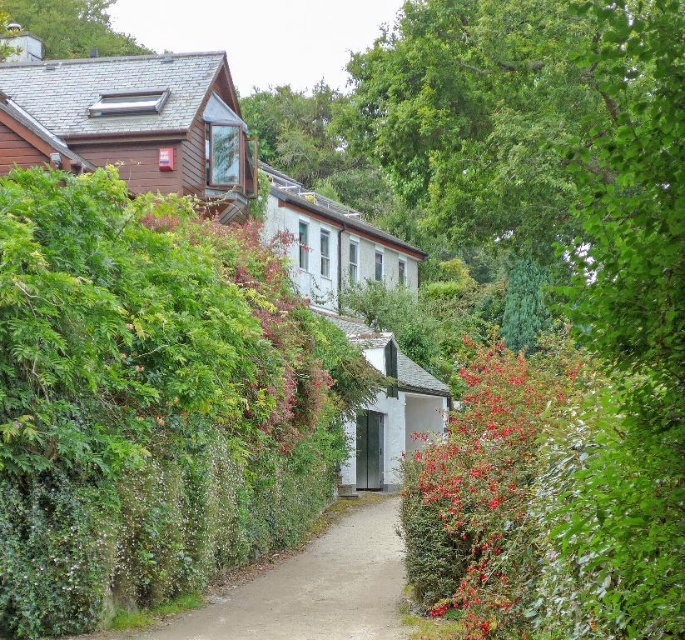
Question: Does wooden cabin at upper left have a smaller size compared to white matte cottage at center?

Choices:
 (A) yes
 (B) no

Answer: (A)

Question: Which object appears farthest from the camera in this image?

Choices:
 (A) dirt path at center
 (B) green leafy tree at upper left
 (C) red matte bush at center

Answer: (B)

Question: Can you confirm if wooden cabin at upper left is bigger than dirt path at center?

Choices:
 (A) yes
 (B) no

Answer: (A)

Question: Which object is the closest to the dirt path at center?

Choices:
 (A) green leafy tree at upper left
 (B) wooden cabin at upper left

Answer: (B)

Question: Which point appears closest to the camera in this image?

Choices:
 (A) (49, 42)
 (B) (316, 557)
 (C) (451, 609)

Answer: (C)

Question: Does green leafy hedge at center come behind white matte cottage at center?

Choices:
 (A) no
 (B) yes

Answer: (A)